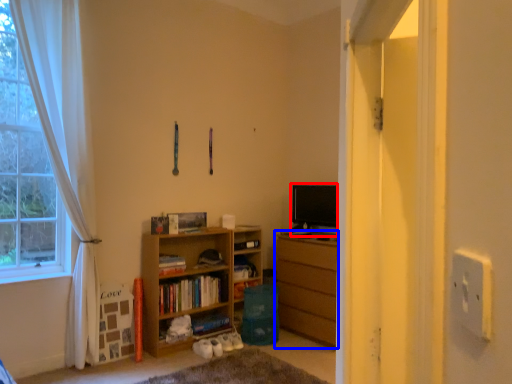
Question: Among these objects, which one is nearest to the camera, level (highlighted by a red box) or chest of drawers (highlighted by a blue box)?

Choices:
 (A) level
 (B) chest of drawers

Answer: (B)